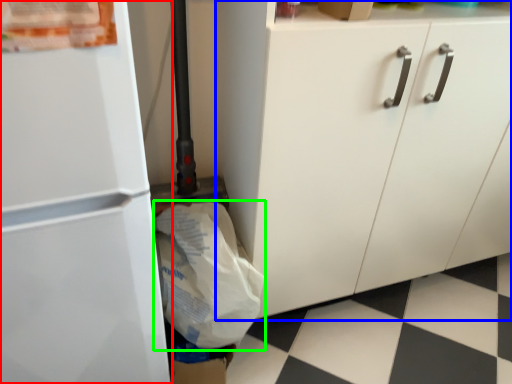
Question: Based on their relative distances, which object is nearer to refrigerator (highlighted by a red box)? Choose from cabinetry (highlighted by a blue box) and grocery bag (highlighted by a green box).

Choices:
 (A) cabinetry
 (B) grocery bag

Answer: (B)